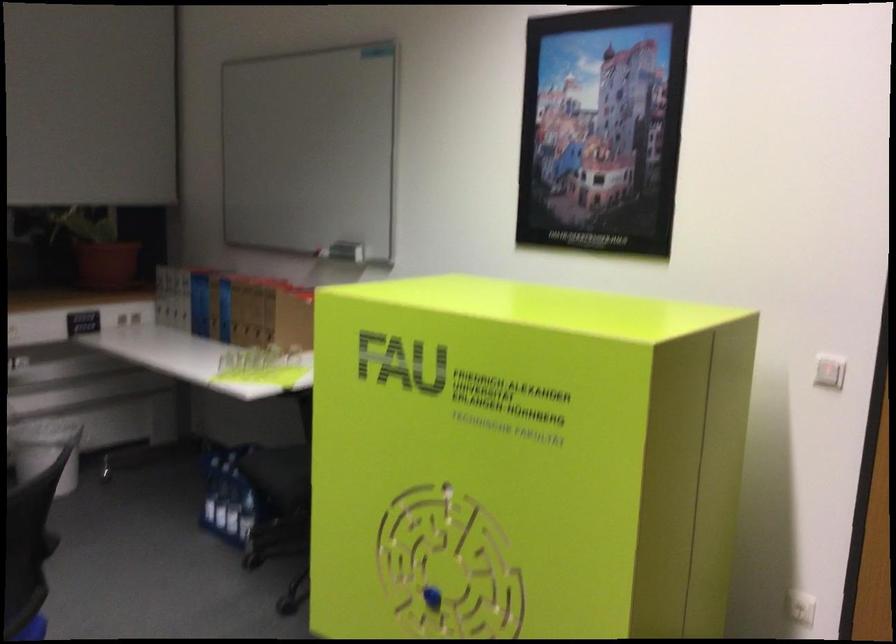
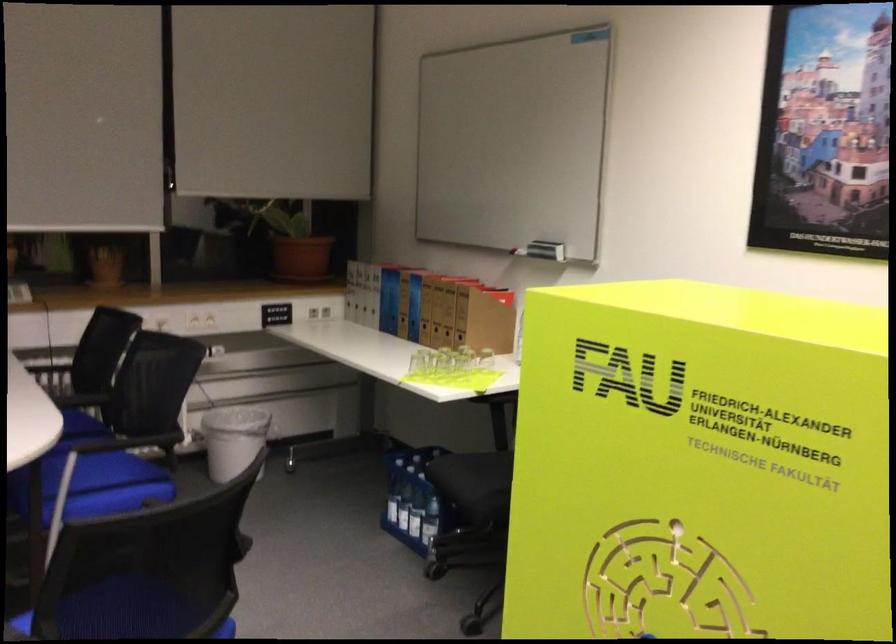
Question: The camera is either moving clockwise (left) or counter-clockwise (right) around the object. The first image is from the beginning of the video and the second image is from the end. Is the camera moving left or right when shooting the video?

Choices:
 (A) Left
 (B) Right

Answer: (B)